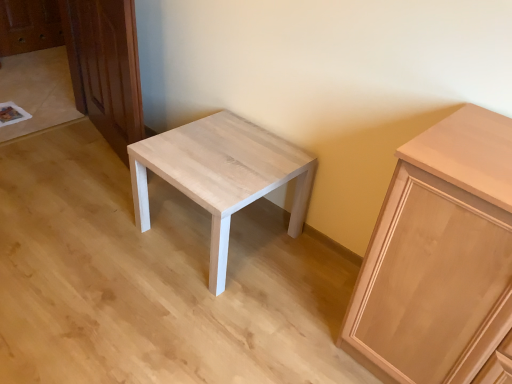
What is the approximate width of light brown wood cabinet at right?

19.74 inches.

Locate an element on the screen. light brown wood dresser at left is located at coordinates (105, 67).

The height and width of the screenshot is (384, 512). Identify the location of light brown wood cabinet at right. (439, 256).

Between point (118, 131) and point (412, 261), which one is positioned behind?

Point (118, 131)

Considering the sizes of light brown wood dresser at left and light brown wood cabinet at right in the image, is light brown wood dresser at left bigger or smaller than light brown wood cabinet at right?

light brown wood dresser at left is smaller than light brown wood cabinet at right.

Image resolution: width=512 pixels, height=384 pixels. What are the coordinates of `cabinetry below the light brown wood dresser at left (from the image's perspective)` in the screenshot? It's located at (439, 256).

Considering the positions of objects light brown wood cabinet at right and light brown wood dresser at left in the image provided, who is more to the left, light brown wood cabinet at right or light brown wood dresser at left?

light brown wood dresser at left is more to the left.

Where is `dresser above the light brown wood cabinet at right (from the image's perspective)`? Image resolution: width=512 pixels, height=384 pixels. dresser above the light brown wood cabinet at right (from the image's perspective) is located at coordinates (105, 67).

Who is shorter, light brown wood cabinet at right or light brown wood dresser at left?

Standing shorter between the two is light brown wood cabinet at right.

From the image's perspective, which one is positioned higher, light brown wood cabinet at right or light brown wood dresser at left?

light brown wood dresser at left, from the image's perspective.

Considering the relative sizes of light wood/texture stool at center and light brown wood dresser at left in the image provided, is light wood/texture stool at center bigger than light brown wood dresser at left?

Yes, light wood/texture stool at center is bigger than light brown wood dresser at left.

Considering the sizes of light wood/texture stool at center and light brown wood dresser at left in the image, is light wood/texture stool at center wider or thinner than light brown wood dresser at left?

In the image, light wood/texture stool at center appears to be wider than light brown wood dresser at left.

From the image's perspective, between light wood/texture stool at center and light brown wood dresser at left, which one is located above?

From the image's view, light brown wood dresser at left is above.

From the picture: From a real-world perspective, who is located higher, light wood/texture stool at center or light brown wood dresser at left?

light brown wood dresser at left is physically above.

Considering the sizes of objects light wood/texture stool at center and light brown wood cabinet at right in the image provided, who is wider, light wood/texture stool at center or light brown wood cabinet at right?

With larger width is light wood/texture stool at center.

Is light wood/texture stool at center aimed at light brown wood cabinet at right?

No, light wood/texture stool at center is not oriented towards light brown wood cabinet at right.

Is light wood/texture stool at center not within light brown wood cabinet at right?

light wood/texture stool at center lies outside light brown wood cabinet at right's area.

Image resolution: width=512 pixels, height=384 pixels. Identify the location of cabinetry in front of the light wood/texture stool at center. (439, 256).

From a real-world perspective, is light brown wood cabinet at right above or below light wood/texture stool at center?

light brown wood cabinet at right is above light wood/texture stool at center.

Considering the relative sizes of light brown wood cabinet at right and light wood/texture stool at center in the image provided, is light brown wood cabinet at right taller than light wood/texture stool at center?

Correct, light brown wood cabinet at right is much taller as light wood/texture stool at center.

Is light brown wood cabinet at right positioned in front of light wood/texture stool at center?

Yes, it is.

Considering the sizes of light brown wood dresser at left and light wood/texture stool at center in the image, is light brown wood dresser at left bigger or smaller than light wood/texture stool at center?

Clearly, light brown wood dresser at left is smaller in size than light wood/texture stool at center.

Based on the photo, considering the sizes of light brown wood dresser at left and light wood/texture stool at center in the image, is light brown wood dresser at left wider or thinner than light wood/texture stool at center?

In the image, light brown wood dresser at left appears to be more narrow than light wood/texture stool at center.

Does light brown wood dresser at left turn towards light wood/texture stool at center?

No.

What's the angular difference between light brown wood dresser at left and light wood/texture stool at center's facing directions?

13.2 degrees.

In order to click on cabinetry below the light brown wood dresser at left (from a real-world perspective) in this screenshot , I will do `click(439, 256)`.

Locate an element on the screen. The image size is (512, 384). cabinetry on the right of light brown wood dresser at left is located at coordinates (439, 256).

Which object lies further to the anchor point light brown wood dresser at left, light wood/texture stool at center or light brown wood cabinet at right?

light brown wood cabinet at right is positioned further to the anchor light brown wood dresser at left.

Based on their spatial positions, is light brown wood cabinet at right or light wood/texture stool at center further from light brown wood dresser at left?

light brown wood cabinet at right lies further to light brown wood dresser at left than the other object.

Which object lies further to the anchor point light wood/texture stool at center, light brown wood dresser at left or light brown wood cabinet at right?

The object further to light wood/texture stool at center is light brown wood cabinet at right.

Which object lies further to the anchor point light brown wood cabinet at right, light brown wood dresser at left or light wood/texture stool at center?

Based on the image, light brown wood dresser at left appears to be further to light brown wood cabinet at right.

Which object lies nearer to the anchor point light brown wood cabinet at right, light wood/texture stool at center or light brown wood dresser at left?

light wood/texture stool at center lies closer to light brown wood cabinet at right than the other object.

Looking at this image, estimate the real-world distances between objects in this image. Which object is closer to light wood/texture stool at center, light brown wood cabinet at right or light brown wood dresser at left?

The object closer to light wood/texture stool at center is light brown wood dresser at left.

You are a GUI agent. You are given a task and a screenshot of the screen. Output one action in this format:
    pyautogui.click(x=<x>, y=<y>)
    Task: Click on the stool between light brown wood dresser at left and light brown wood cabinet at right
    
    Given the screenshot: What is the action you would take?
    pyautogui.click(x=221, y=175)